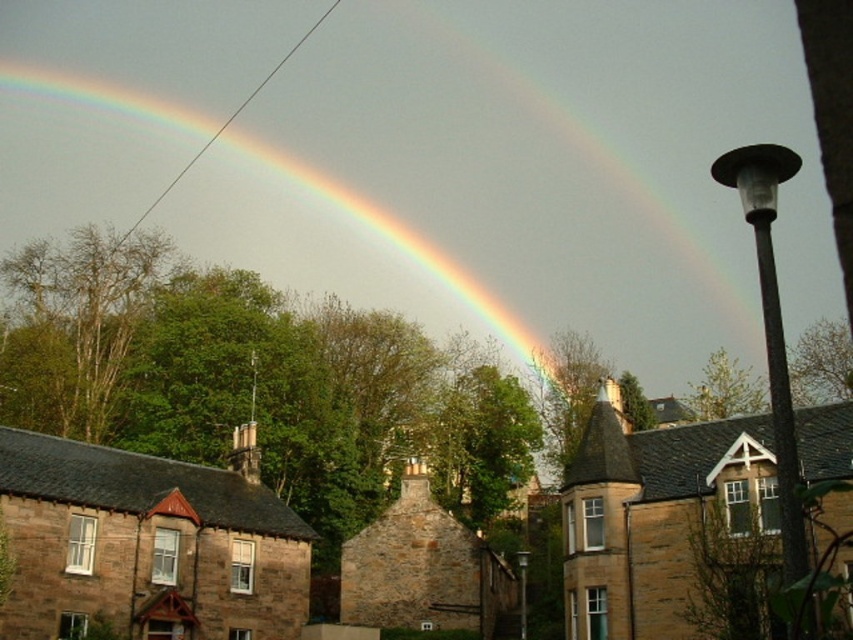
You are standing in the urban scene and want to take a photo that includes both the point at coordinates point[35,186] and point[100,564]. Which point should you position closer to the camera to ensure both are in the frame?

Since point[35,186] is further to the camera than point[100,564], you should position point[100,564] closer to the camera to ensure both are in the frame.

You are standing in the foreground of the scene looking towards the sky. Where is the rainbow at upper center located in terms of its 2D coordinates?

The rainbow at upper center is located at the 2D coordinates of point (325, 241).

You are standing in front of the brown stone house at lower left and want to take a photo of the rainbow at upper center. Considering the distance between them, can you capture the entire rainbow in one shot without moving your position?

The rainbow at upper center is 113.61 meters away from the brown stone house at lower left. Since the distance is significant, capturing the entire rainbow in one shot without moving your position may be challenging unless you have a wide enough lens or camera angle.